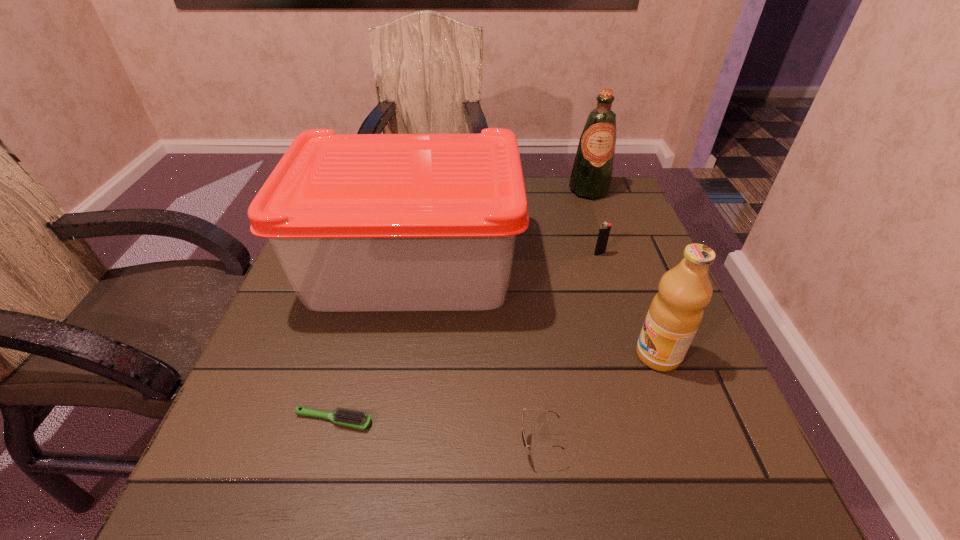
What are the coordinates of `the farther olive oil` in the screenshot? It's located at (591, 176).

At what (x,y) coordinates should I click in order to perform the action: click on tray. Please return your answer as a coordinate pair (x, y). The height and width of the screenshot is (540, 960). Looking at the image, I should click on pyautogui.click(x=359, y=222).

At what (x,y) coordinates should I click in order to perform the action: click on the third nearest object. Please return your answer as a coordinate pair (x, y). The height and width of the screenshot is (540, 960). Looking at the image, I should click on (676, 311).

What are the coordinates of `the fourth tallest object` in the screenshot? It's located at pos(604,231).

Find the location of a particular element. The image size is (960, 540). the fifth tallest object is located at coordinates (523, 431).

Locate an element on the screen. The height and width of the screenshot is (540, 960). the shortest object is located at coordinates (355, 419).

Image resolution: width=960 pixels, height=540 pixels. I want to click on vacant area situated on the front-facing side of the farthest object, so click(597, 214).

This screenshot has height=540, width=960. I want to click on vacant position located 0.290m on the front of the tray, so click(x=374, y=475).

Find the location of a particular element. The width and height of the screenshot is (960, 540). vacant space located on the label of the fourth farthest object is located at coordinates (564, 355).

The height and width of the screenshot is (540, 960). I want to click on blank area located 0.120m on the label of the fourth farthest object, so click(x=569, y=355).